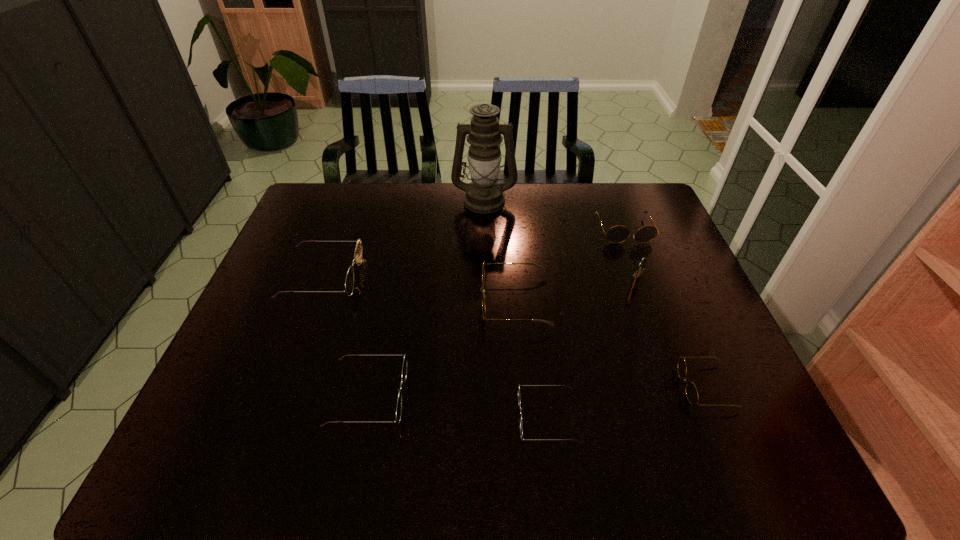
The image size is (960, 540). Identify the location of the tallest object. (483, 195).

Image resolution: width=960 pixels, height=540 pixels. I want to click on oil lamp, so click(483, 195).

Locate an element on the screen. This screenshot has height=540, width=960. padlock is located at coordinates (636, 279).

Find the location of a particular element. The width and height of the screenshot is (960, 540). the biggest gray sunglasses is located at coordinates (541, 267).

Locate an element on the screen. the second nearest gray sunglasses is located at coordinates (541, 267).

The image size is (960, 540). Identify the location of the leftmost sunglasses. (358, 253).

Locate an element on the screen. The height and width of the screenshot is (540, 960). the leftmost object is located at coordinates (358, 253).

Where is `the farthest sunglasses`? The image size is (960, 540). the farthest sunglasses is located at coordinates pos(617,234).

I want to click on the seventh nearest object, so click(617, 234).

Identify the location of the fifth sunglasses from right to left. (404, 368).